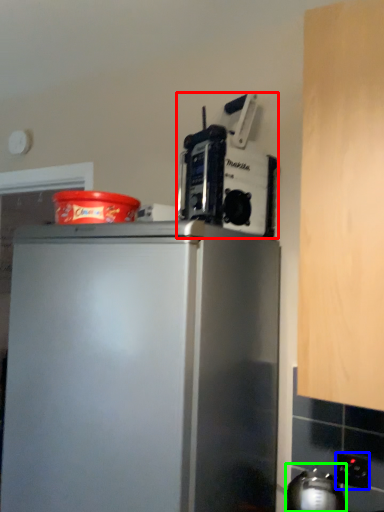
Question: Based on their relative distances, which object is farther from kitchen appliance (highlighted by a red box)? Choose from electric outlet (highlighted by a blue box) and appliance (highlighted by a green box).

Choices:
 (A) electric outlet
 (B) appliance

Answer: (A)